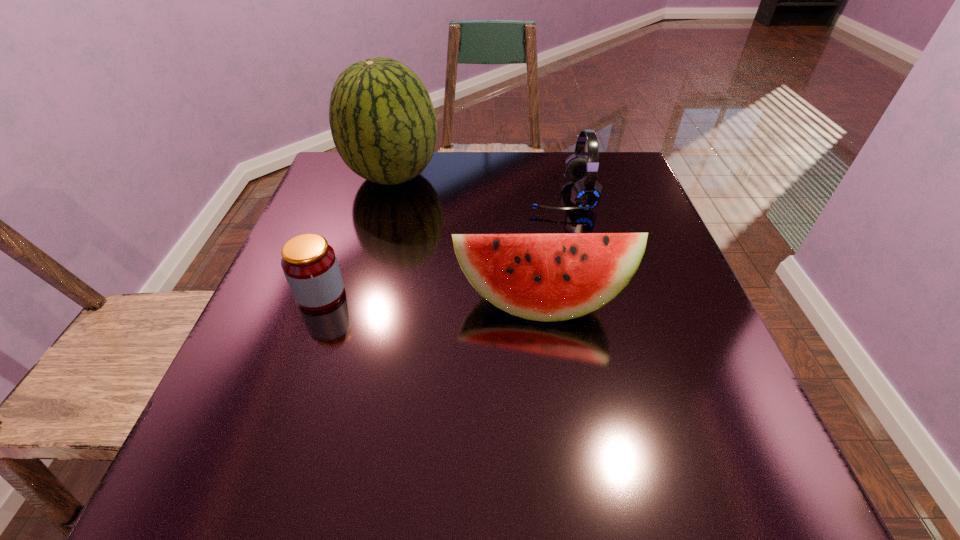
Locate an element on the screen. The height and width of the screenshot is (540, 960). the left watermelon is located at coordinates (383, 124).

Find the location of `the tallest object`. the tallest object is located at coordinates (383, 124).

In order to click on the shorter watermelon in this screenshot , I will do `click(544, 277)`.

Locate an element on the screen. Image resolution: width=960 pixels, height=540 pixels. the nearer watermelon is located at coordinates (544, 277).

The width and height of the screenshot is (960, 540). I want to click on headset, so click(x=586, y=193).

The height and width of the screenshot is (540, 960). Identify the location of jar. (309, 263).

This screenshot has width=960, height=540. I want to click on free space located 0.190m on the front of the taller watermelon, so click(372, 254).

The width and height of the screenshot is (960, 540). What are the coordinates of `free point located on the outer rind of the nearer watermelon` in the screenshot? It's located at (552, 408).

Find the location of a particular element. free region located 0.100m on the ear cushions of the headset is located at coordinates (488, 195).

At what (x,y) coordinates should I click in order to perform the action: click on free space located on the ear cushions of the headset. Please return your answer as a coordinate pair (x, y). Looking at the image, I should click on click(380, 195).